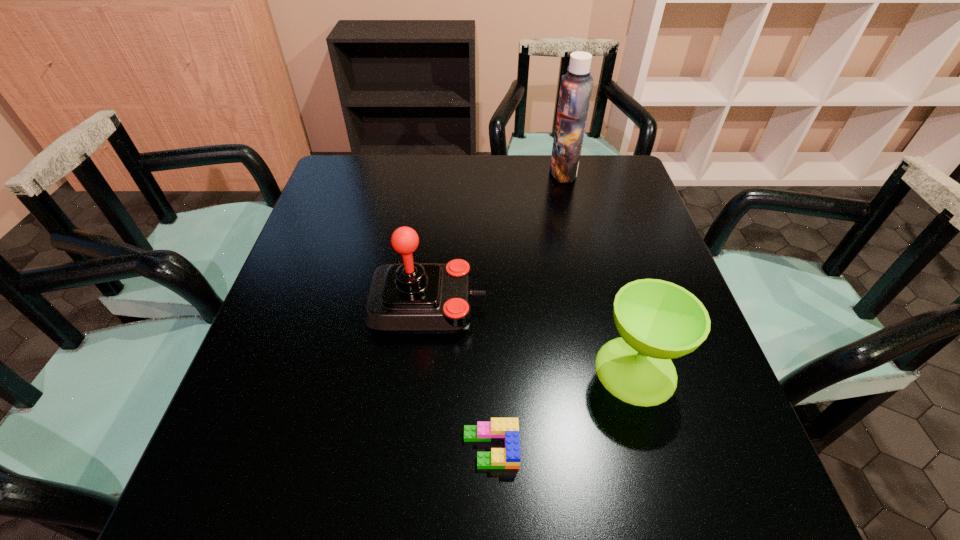
In the image, there is a desktop. Where is `free space at the right edge`? free space at the right edge is located at coordinates (696, 438).

Locate an element on the screen. This screenshot has height=540, width=960. free space at the far left corner of the desktop is located at coordinates (344, 169).

Image resolution: width=960 pixels, height=540 pixels. Identify the location of free spot at the far right corner of the desktop. (628, 175).

The image size is (960, 540). I want to click on vacant area between the third shortest object and the wineglass, so 532,338.

This screenshot has width=960, height=540. I want to click on free space between the shampoo and the wineglass, so click(x=599, y=271).

Identify the location of unoccupied area between the wineglass and the shampoo. (599, 271).

Locate an element on the screen. This screenshot has height=540, width=960. empty location between the tallest object and the wineglass is located at coordinates (599, 271).

Find the location of a particular element. Image resolution: width=960 pixels, height=540 pixels. vacant space that is in between the farthest object and the shortest object is located at coordinates (527, 310).

The height and width of the screenshot is (540, 960). What are the coordinates of `vacant space that's between the second tallest object and the shampoo` in the screenshot? It's located at (495, 239).

In order to click on vacant area that lies between the farthest object and the second shortest object in this screenshot , I will do `click(599, 271)`.